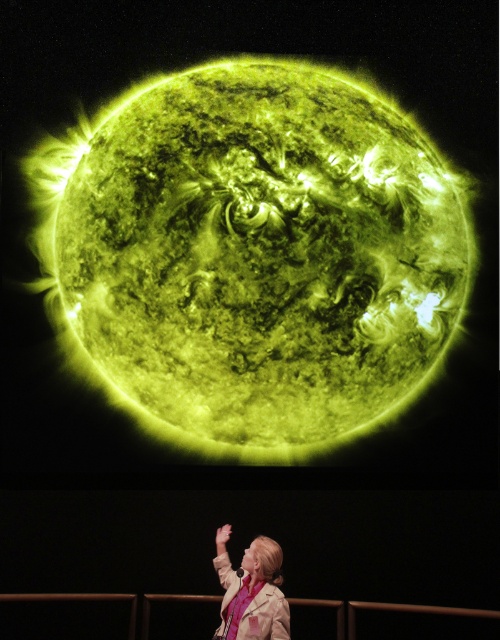
Who is more forward, (308, 144) or (231, 525)?

Point (231, 525) is more forward.

Does yellow/glowing plasma sun at upper center appear over smooth skin hand at lower center?

Yes.

Who is more forward, (111, 314) or (226, 536)?

Point (226, 536) is in front.

Image resolution: width=500 pixels, height=640 pixels. Identify the location of yellow/glowing plasma sun at upper center. (253, 256).

Between point (210, 316) and point (269, 545), which one is positioned in front?

Positioned in front is point (269, 545).

What do you see at coordinates (253, 256) in the screenshot?
I see `yellow/glowing plasma sun at upper center` at bounding box center [253, 256].

Find the location of `yellow/glowing plasma sun at upper center`. yellow/glowing plasma sun at upper center is located at coordinates (253, 256).

Is point (270, 605) closer to viewer compared to point (219, 547)?

Yes, it is in front of point (219, 547).

Between beige fabric jacket at lower center and smooth skin hand at lower center, which one appears on the left side from the viewer's perspective?

smooth skin hand at lower center is more to the left.

In order to click on beige fabric jacket at lower center in this screenshot , I will do `click(254, 593)`.